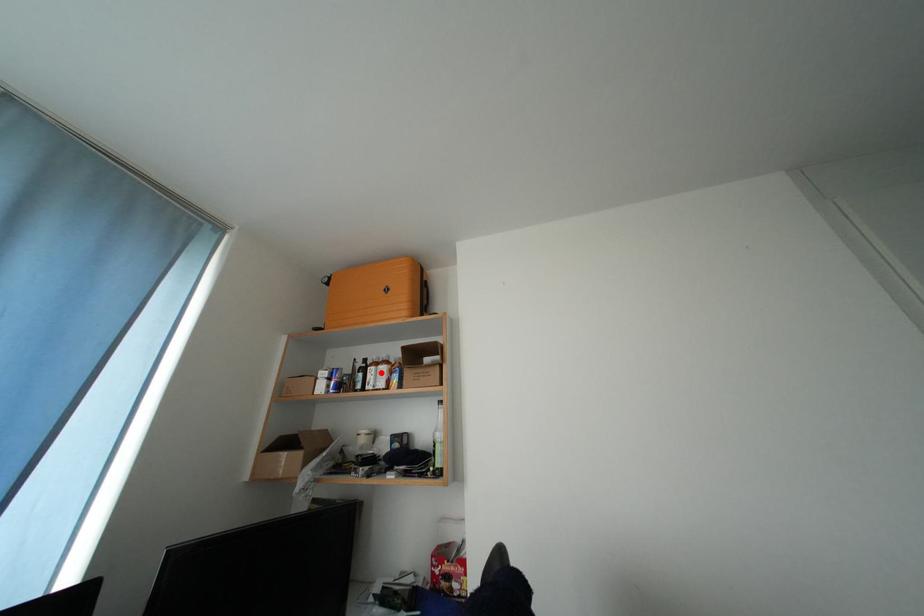
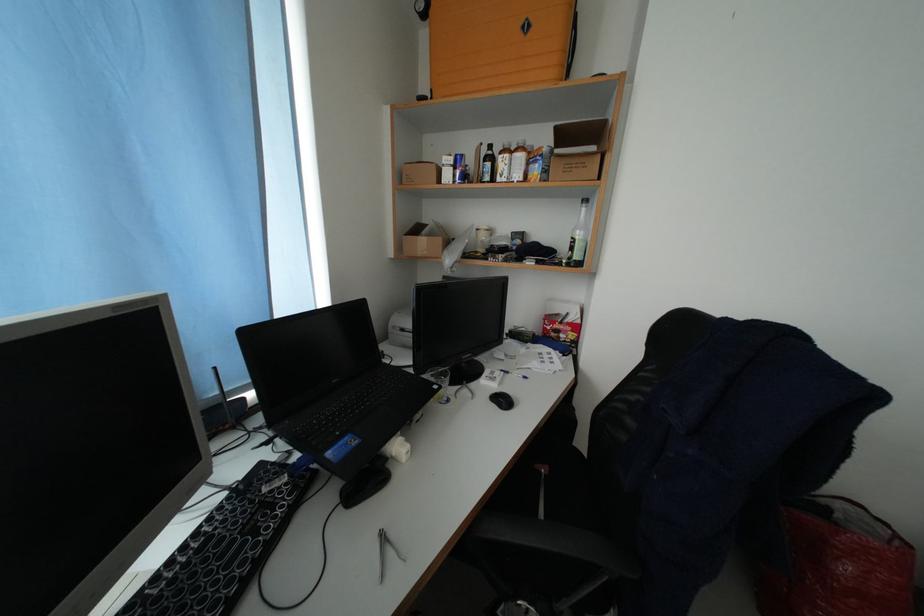
Where in the second image is the point corresponding to the highlighted location from the first image?

(515, 161)